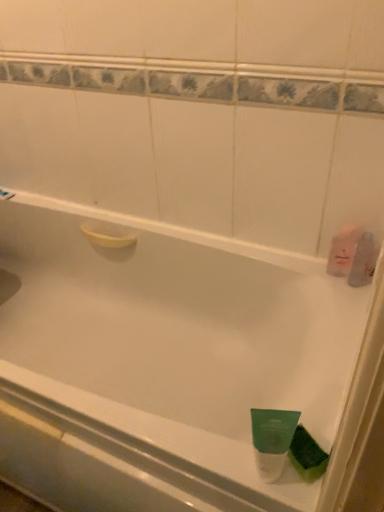
Question: Considering the positions of clear plastic bottle at right, the second mouthwash positioned from the back, and white glossy shower at upper left in the image, is clear plastic bottle at right, the second mouthwash positioned from the back, taller or shorter than white glossy shower at upper left?

Choices:
 (A) tall
 (B) short

Answer: (A)

Question: Is clear plastic bottle at right, the second mouthwash positioned from the back, to the left or to the right of white glossy shower at upper left in the image?

Choices:
 (A) right
 (B) left

Answer: (A)

Question: Which object is the closest to the green matte mouthwash at bottom right, which is the 2th mouthwash from front to back?

Choices:
 (A) green matte tube at bottom right, which is the 3th mouthwash in top-to-bottom order
 (B) white glossy shower at upper left
 (C) clear plastic bottle at right, the fourth mouthwash viewed from the left
 (D) pink translucent bottle at right, which ranks as the 1th mouthwash in back-to-front order

Answer: (A)

Question: Which of these objects is positioned farthest from the green matte mouthwash at bottom right, the first mouthwash when ordered from bottom to top?

Choices:
 (A) pink translucent bottle at right, which is the 1th mouthwash in top-to-bottom order
 (B) white glossy shower at upper left
 (C) green matte tube at bottom right, which ranks as the 4th mouthwash in back-to-front order
 (D) clear plastic bottle at right, the 1th mouthwash viewed from the right

Answer: (B)